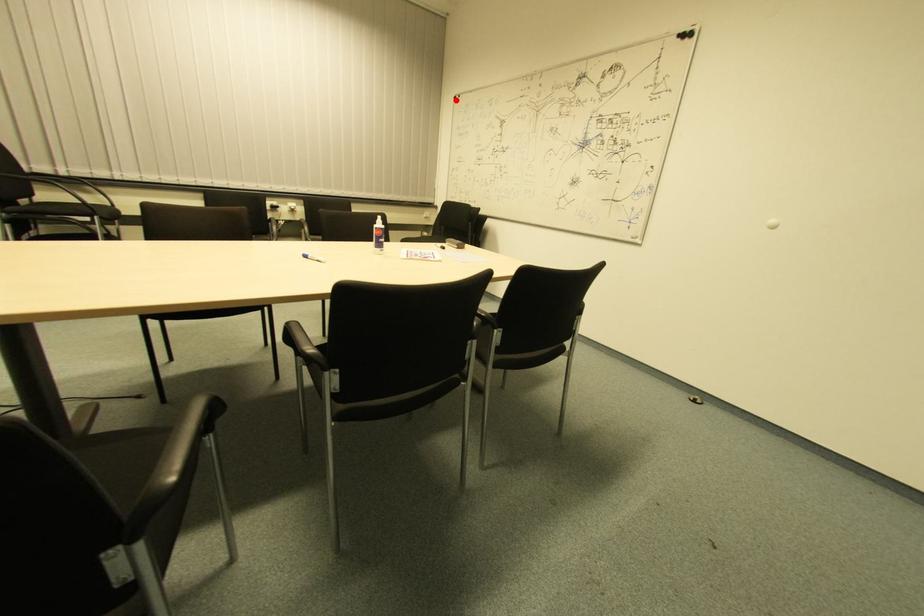
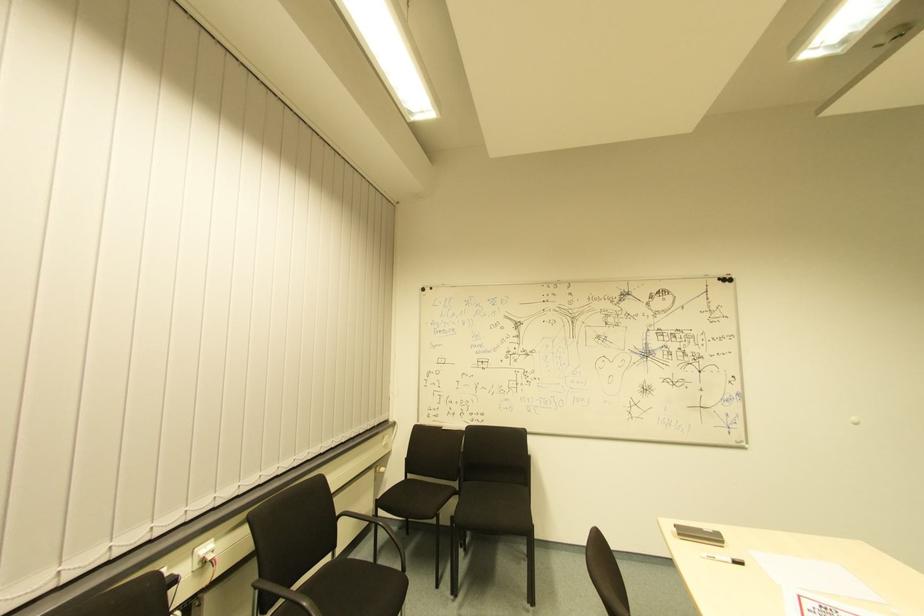
Question: I am providing you with two images of the same scene from different viewpoints. A red point is shown in image1. For the corresponding object point in image2, is it positioned nearer or farther from the camera?

Choices:
 (A) Nearer
 (B) Farther

Answer: (B)